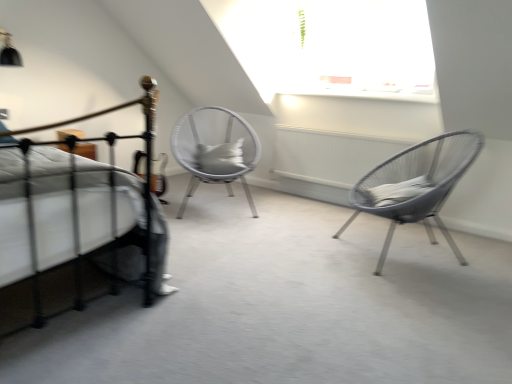
Where is `vacant area that is in front of metallic wire chair at right, the first chair in the front-to-back sequence`? This screenshot has width=512, height=384. vacant area that is in front of metallic wire chair at right, the first chair in the front-to-back sequence is located at coordinates (409, 302).